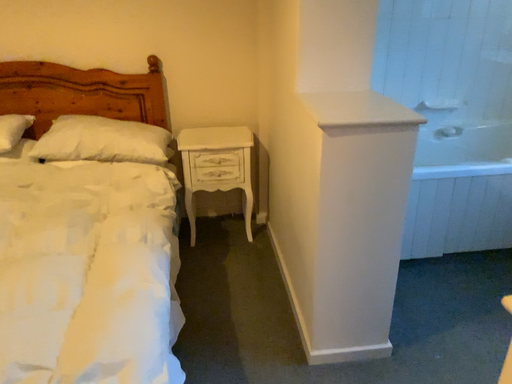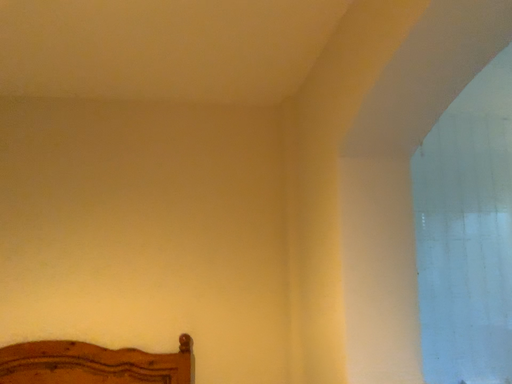
Question: Which way did the camera rotate in the video?

Choices:
 (A) rotated upward
 (B) rotated downward

Answer: (A)